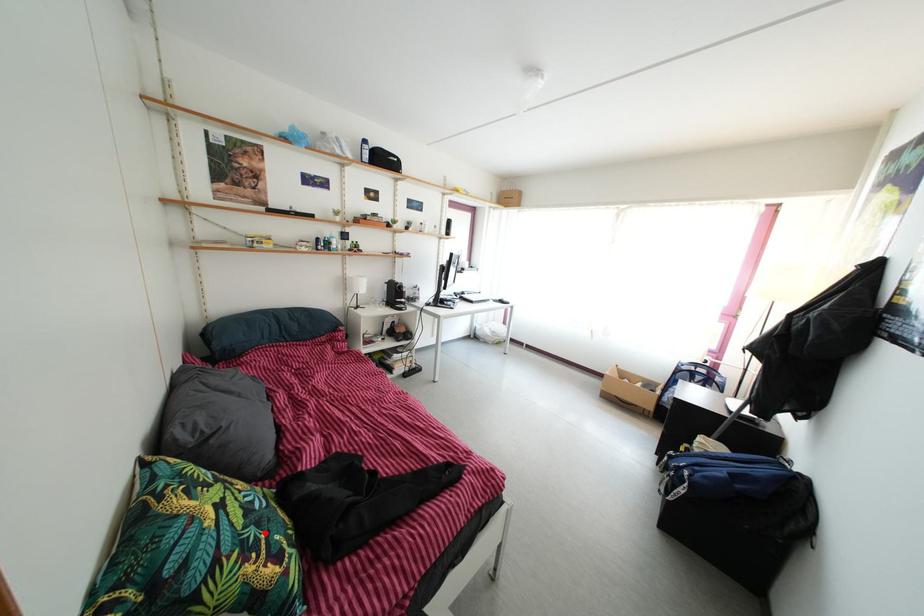
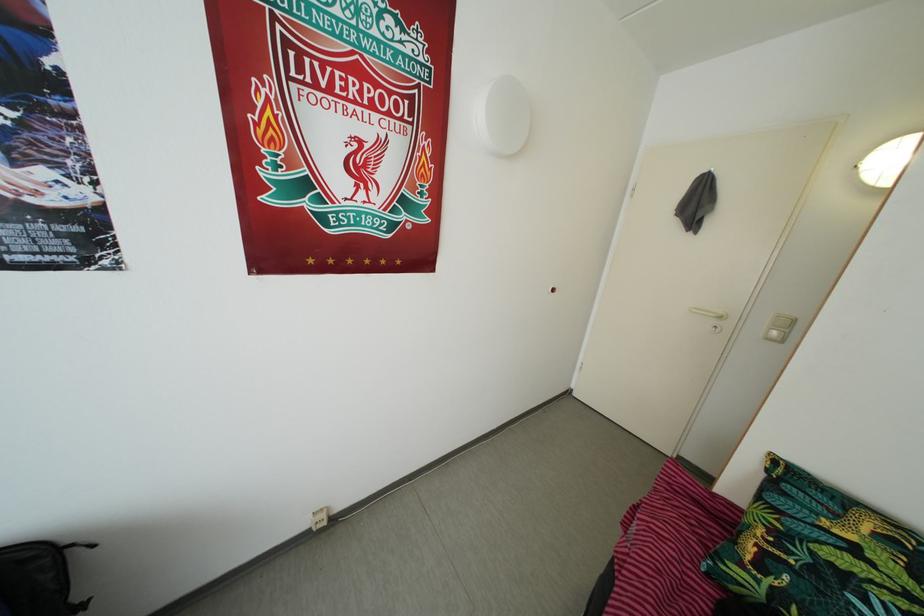
The point at the highlighted location is marked in the first image. Where is the corresponding point in the second image?

(820, 578)